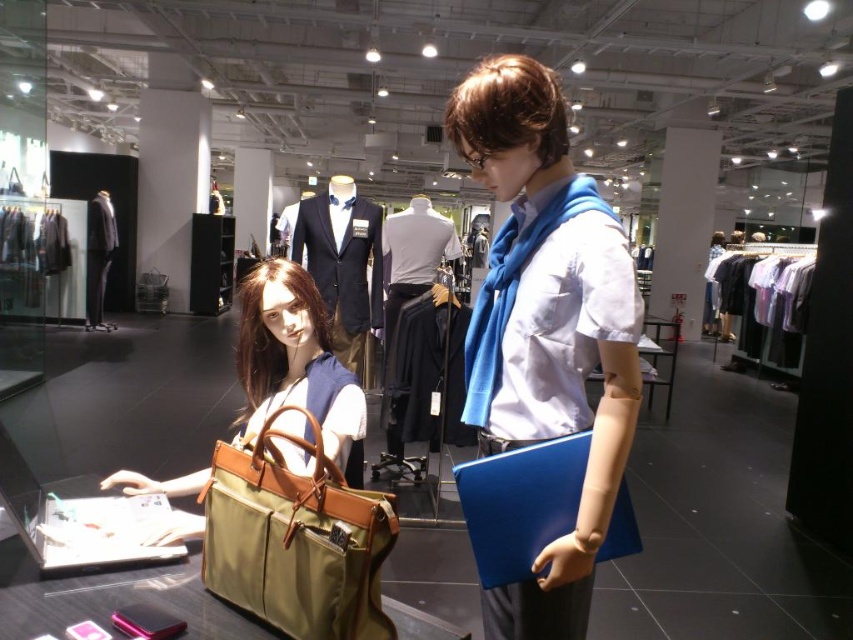
You are a customer in the store and want to pick up the matte brown leather handbag at center and the matte black suit at center. Which item should you look for first if you want to grab the lower one?

The matte brown leather handbag at center is located below the matte black suit at center, so you should look for the matte brown leather handbag at center first.

Where is the white cotton shirt at center located in the image?

The white cotton shirt at center is located at point coordinates of (413, 253).